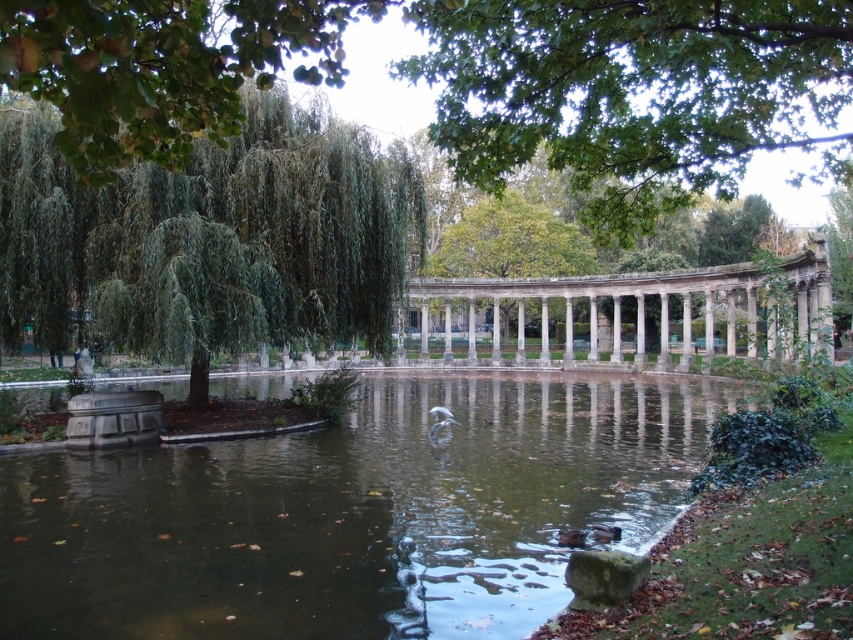
Question: Can you confirm if clear water at center is bigger than green leafy tree at upper center?

Choices:
 (A) yes
 (B) no

Answer: (B)

Question: Can you confirm if green leafy willow at left is positioned above green leafy tree at upper center?

Choices:
 (A) yes
 (B) no

Answer: (B)

Question: Which object is the closest to the green leafy willow at left?

Choices:
 (A) green leafy tree at center
 (B) clear water at center

Answer: (B)

Question: Can you confirm if green leafy willow at left is positioned to the right of green leafy tree at upper center?

Choices:
 (A) yes
 (B) no

Answer: (B)

Question: Which object is the farthest from the green leafy willow at left?

Choices:
 (A) green leafy tree at center
 (B) clear water at center
 (C) green leafy tree at upper center

Answer: (A)

Question: Which of the following is the farthest from the observer?

Choices:
 (A) (344, 189)
 (B) (505, 196)
 (C) (556, 509)

Answer: (B)